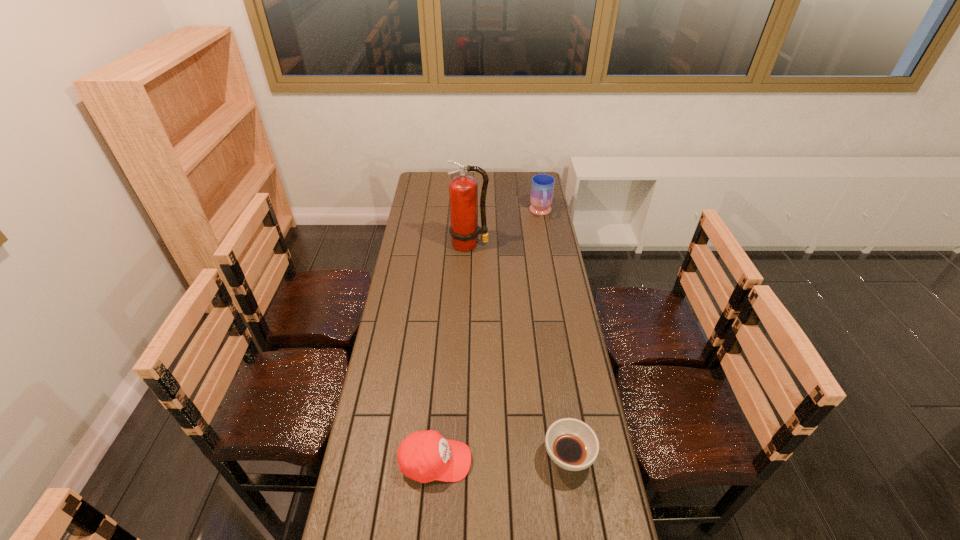
Image resolution: width=960 pixels, height=540 pixels. I want to click on free point between the tallest object and the baseball cap, so click(452, 353).

At what (x,y) coordinates should I click in order to perform the action: click on vacant point located between the shortest object and the second tallest object. Please return your answer as a coordinate pair (x, y). Image resolution: width=960 pixels, height=540 pixels. Looking at the image, I should click on (555, 335).

This screenshot has width=960, height=540. Find the location of `empty space that is in between the third shortest object and the tallest object`. empty space that is in between the third shortest object and the tallest object is located at coordinates (505, 228).

At what (x,y) coordinates should I click in order to perform the action: click on free space between the second farthest object and the baseball cap. Please return your answer as a coordinate pair (x, y). The width and height of the screenshot is (960, 540). Looking at the image, I should click on (452, 353).

You are a GUI agent. You are given a task and a screenshot of the screen. Output one action in this format:
    pyautogui.click(x=<x>, y=<y>)
    Task: Click on the object that is the third closest to the mug
    
    Given the screenshot: What is the action you would take?
    pyautogui.click(x=424, y=456)

Locate which object is the third closest to the tallest object. Please provide its 2D coordinates. Your answer should be formatted as a tuple, i.e. [(x, y)], where the tuple contains the x and y coordinates of a point satisfying the conditions above.

[(424, 456)]

Where is `blank space that satisfies the following two spatial constraints: 1. on the front side of the soup bowl; 2. on the front panel of the baseball cap`? The image size is (960, 540). blank space that satisfies the following two spatial constraints: 1. on the front side of the soup bowl; 2. on the front panel of the baseball cap is located at coordinates (569, 462).

The width and height of the screenshot is (960, 540). What are the coordinates of `free space that satisfies the following two spatial constraints: 1. on the side of the farthest object with the handle; 2. on the front panel of the baseball cap` in the screenshot? It's located at (587, 462).

Locate an element on the screen. The height and width of the screenshot is (540, 960). free space that satisfies the following two spatial constraints: 1. at the nozzle of the second farthest object; 2. on the front panel of the baseball cap is located at coordinates (463, 462).

Find the location of `vacant space that satisfies the following two spatial constraints: 1. at the nozzle of the tallest object; 2. on the front panel of the baseball cap`. vacant space that satisfies the following two spatial constraints: 1. at the nozzle of the tallest object; 2. on the front panel of the baseball cap is located at coordinates (463, 462).